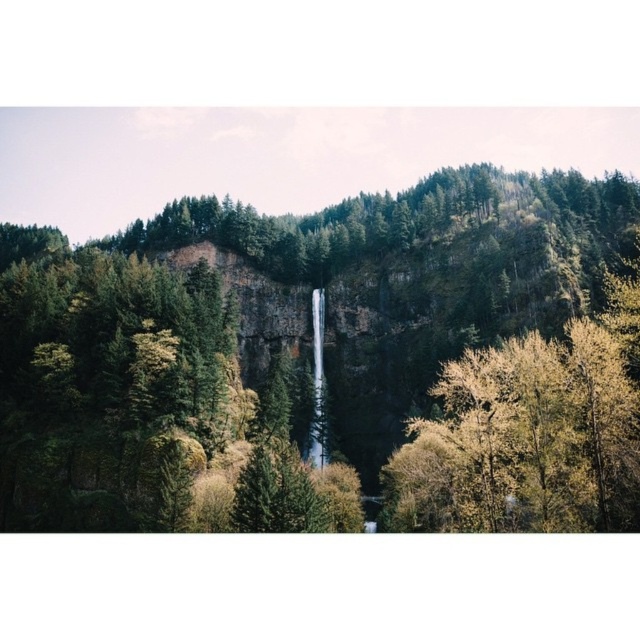
You are a hiker standing at the base of the cliff. You see the green matte forest at center and the transparent glass waterfall at center. Which object appears taller from your vantage point?

The green matte forest at center appears taller than the transparent glass waterfall at center from your vantage point because the green matte forest at center is much taller as transparent glass waterfall at center.

You are a hiker planning to take a photo of the green matte forest at center and the transparent glass waterfall at center. Which object should you focus on if you want to capture the larger subject in your shot?

The green matte forest at center is bigger than the transparent glass waterfall at center, so you should focus on the green matte forest at center to capture the larger subject.